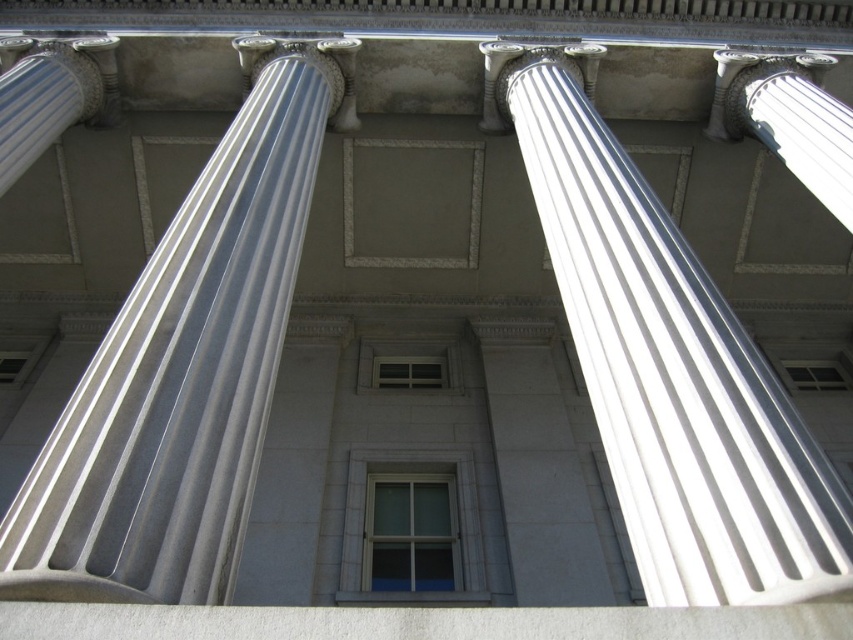
Who is more forward, (109, 352) or (749, 481)?

Point (749, 481) is more forward.

At what (x,y) coordinates should I click in order to perform the action: click on white glossy column at center. Please return your answer as a coordinate pair (x, y). This screenshot has height=640, width=853. Looking at the image, I should click on (184, 369).

In order to click on white glossy column at center in this screenshot , I will do `click(184, 369)`.

Between white glossy column at center and white marble column at upper right, which one has less height?

Standing shorter between the two is white marble column at upper right.

This screenshot has width=853, height=640. Describe the element at coordinates (184, 369) in the screenshot. I see `white glossy column at center` at that location.

The width and height of the screenshot is (853, 640). Find the location of `white glossy column at center`. white glossy column at center is located at coordinates (184, 369).

Between point (827, 522) and point (744, 52), which one is positioned behind?

Positioned behind is point (744, 52).

Is point (676, 497) closer to camera compared to point (782, 72)?

Yes, point (676, 497) is closer to viewer.

Between point (705, 589) and point (820, 109), which one is positioned in front?

Point (705, 589) is more forward.

Find the location of a particular element. This screenshot has height=640, width=853. white marble column at center is located at coordinates (666, 364).